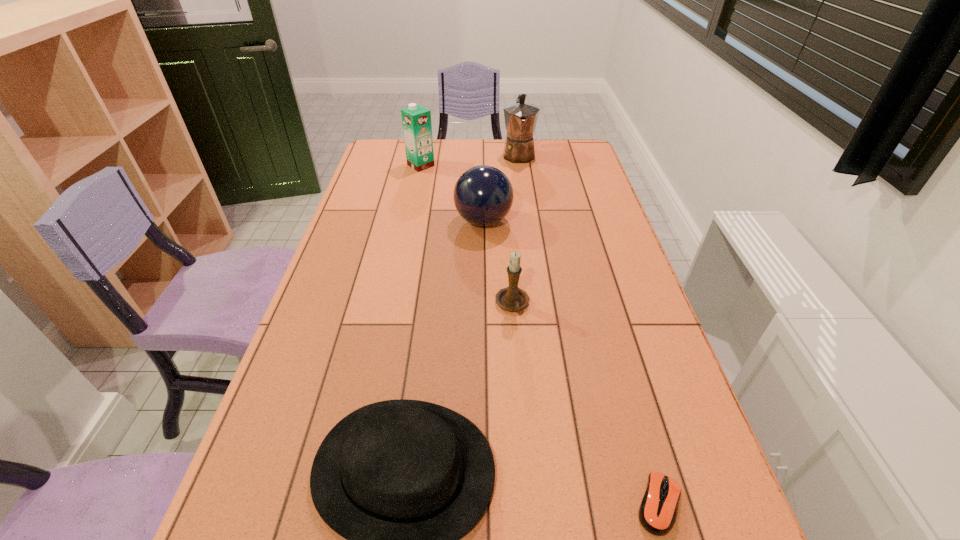
The image size is (960, 540). In the image, there is a desktop. Find the location of `vacant space at the far left corner`. vacant space at the far left corner is located at coordinates (372, 159).

This screenshot has width=960, height=540. In order to click on blank region between the coffeepot and the third nearest object in this screenshot , I will do `click(516, 230)`.

Where is `vacant point located between the rightmost object and the carton`? The width and height of the screenshot is (960, 540). vacant point located between the rightmost object and the carton is located at coordinates (540, 335).

Locate an element on the screen. Image resolution: width=960 pixels, height=540 pixels. free area in between the computer mouse and the carton is located at coordinates (540, 335).

Locate an element on the screen. vacant region between the third farthest object and the carton is located at coordinates (452, 193).

Find the location of a particular element. The image size is (960, 540). blank region between the third farthest object and the fourth farthest object is located at coordinates (498, 263).

Locate an element on the screen. This screenshot has height=540, width=960. object that stands as the fifth closest to the third nearest object is located at coordinates (521, 118).

Locate an element on the screen. the closest object to the fedora is located at coordinates (511, 298).

Locate an element on the screen. vacant area that satisfies the following two spatial constraints: 1. on the pouring side of the coffeepot; 2. on the surface of the bowling ball near the finger holes is located at coordinates 528,221.

Locate an element on the screen. The image size is (960, 540). blank space that satisfies the following two spatial constraints: 1. on the pouring side of the coffeepot; 2. on the surface of the fourth nearest object near the finger holes is located at coordinates (528, 221).